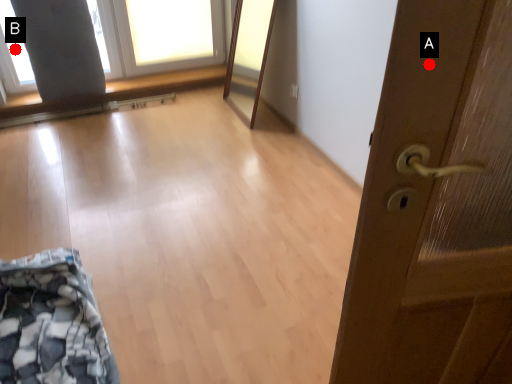
Question: Two points are circled on the image, labeled by A and B beside each circle. Among these points, which one is farthest from the camera?

Choices:
 (A) A is further
 (B) B is further

Answer: (B)